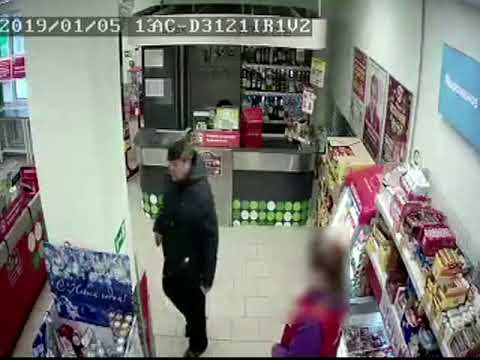
What are the coordinates of `this is where the cashier stands` in the screenshot? It's located at (212, 116).